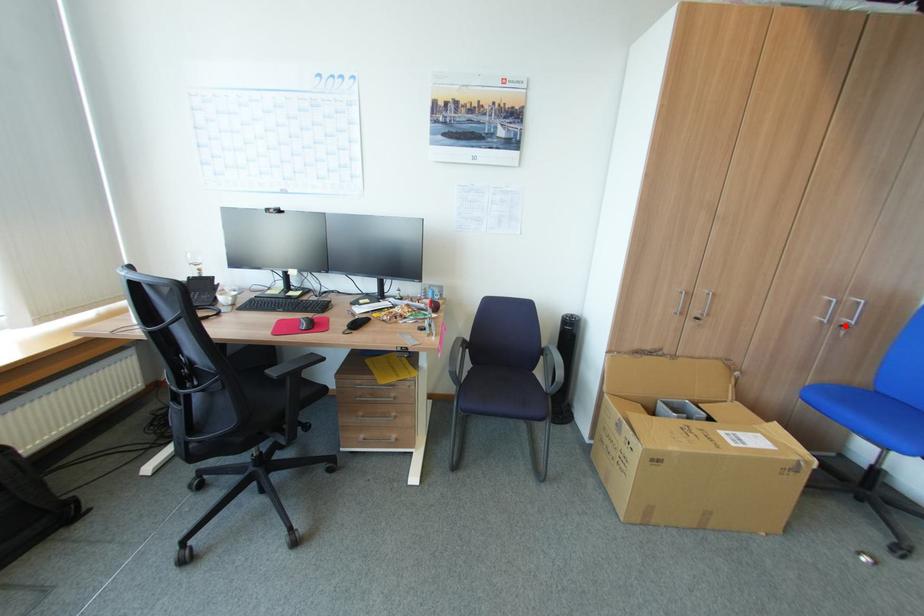
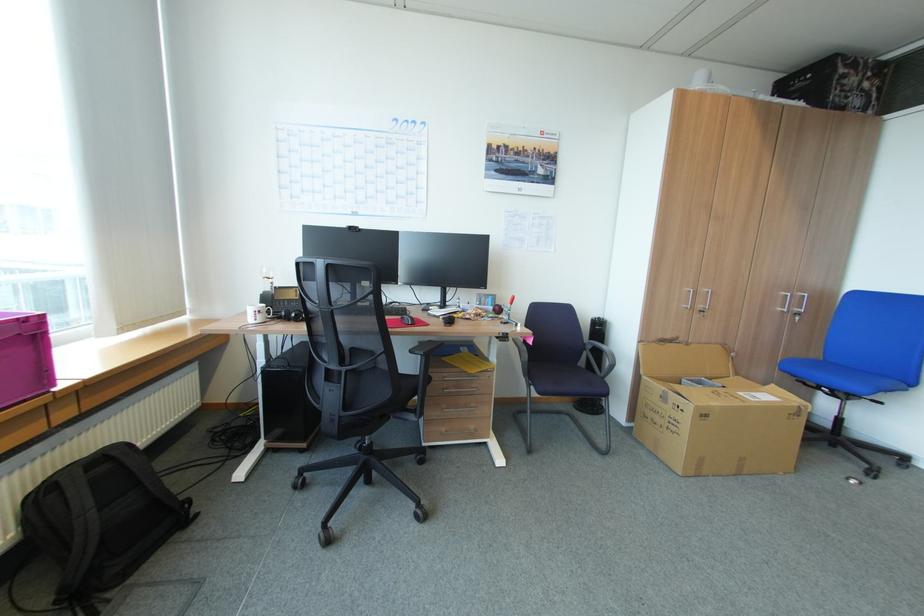
Find the pixel in the second image that matches the highlighted location in the first image.

(800, 314)